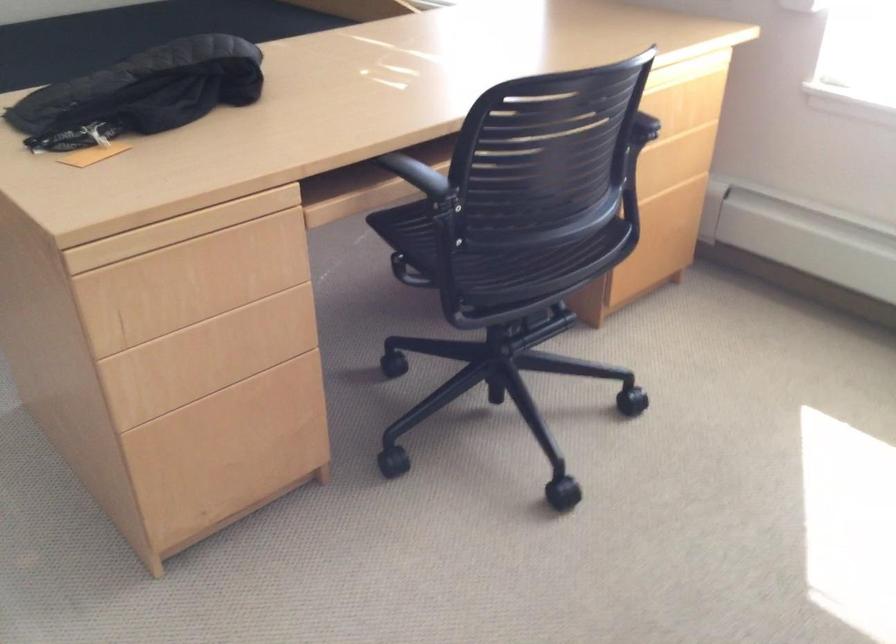
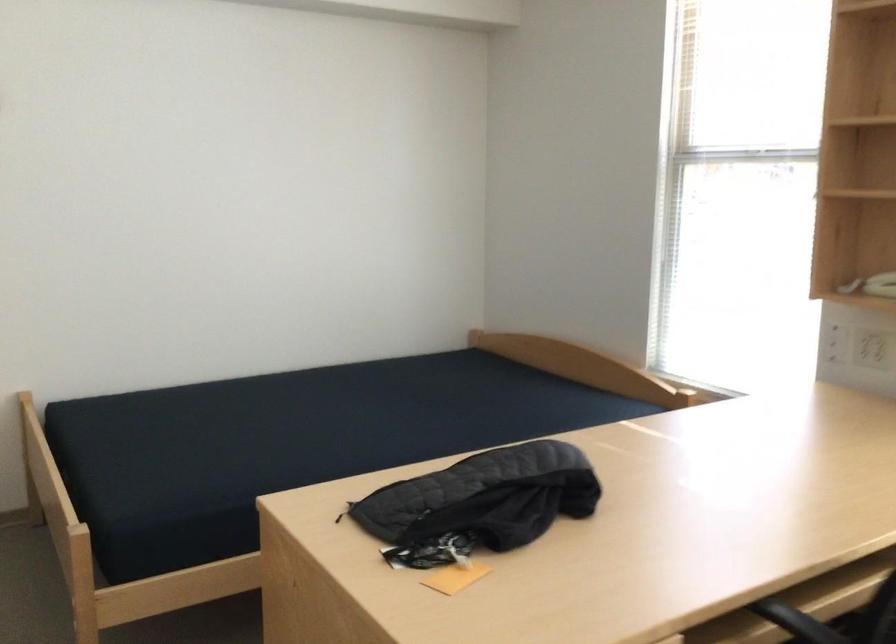
Question: The first image is from the beginning of the video and the second image is from the end. How did the camera likely rotate when shooting the video?

Choices:
 (A) Left
 (B) Right
 (C) Up
 (D) Down

Answer: (C)